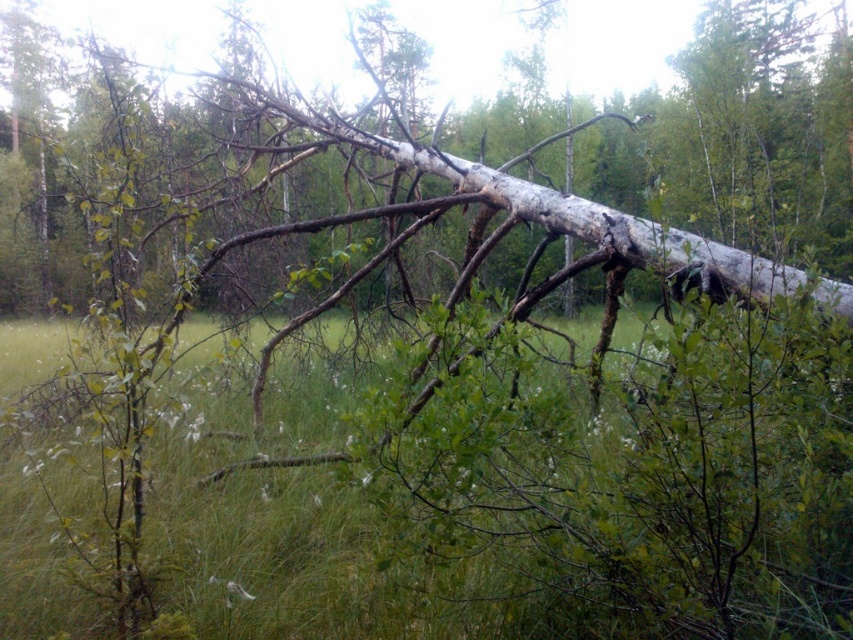
Consider the image. Which is more to the left, green grass at center or white bark tree at center?

green grass at center is more to the left.

Which is above, green grass at center or white bark tree at center?

Positioned higher is white bark tree at center.

Between point (610, 422) and point (106, 17), which one is positioned behind?

The point (106, 17) is behind.

Find the location of a particular element. The width and height of the screenshot is (853, 640). green grass at center is located at coordinates (531, 493).